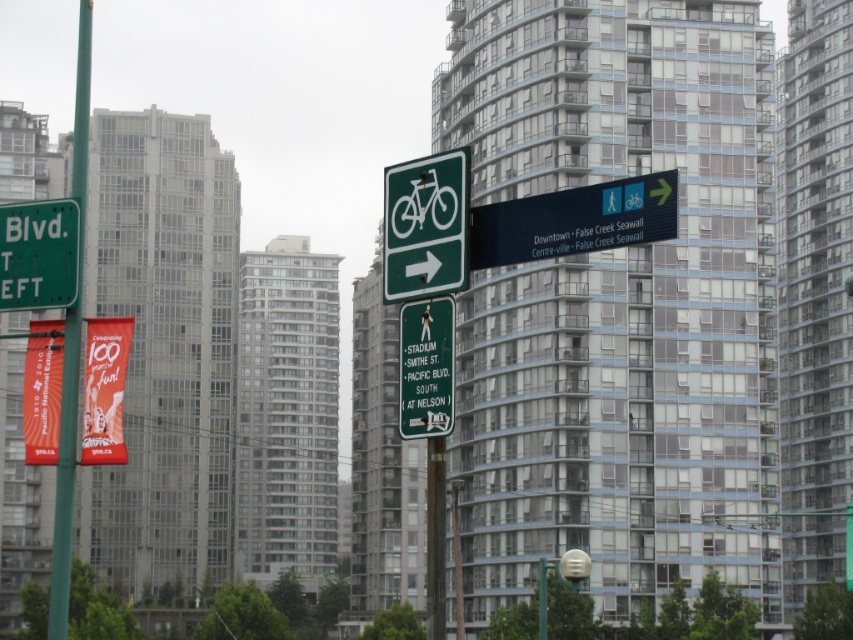
This screenshot has height=640, width=853. I want to click on green matte sign at upper left, so click(38, 253).

Does green matte sign at upper left appear on the right side of green matte sign at center?

No, green matte sign at upper left is not to the right of green matte sign at center.

Between point (74, 202) and point (402, 396), which one is positioned in front?

Point (402, 396) is more forward.

You are a GUI agent. You are given a task and a screenshot of the screen. Output one action in this format:
    pyautogui.click(x=<x>, y=<y>)
    Task: Click on the green matte sign at upper left
    The image size is (853, 640).
    Given the screenshot: What is the action you would take?
    pyautogui.click(x=38, y=253)

Between green matte bicycle at center and green matte sign at center, which one appears on the left side from the viewer's perspective?

From the viewer's perspective, green matte sign at center appears more on the left side.

Between point (461, 268) and point (425, 301), which one is positioned behind?

The point (425, 301) is more distant.

At what (x,y) coordinates should I click in order to perform the action: click on green matte bicycle at center. Please return your answer as a coordinate pair (x, y). The image size is (853, 640). Looking at the image, I should click on (426, 227).

Who is more distant from viewer, (x=567, y=198) or (x=409, y=435)?

The point (x=409, y=435) is behind.

Does dark blue plastic sign at center appear on the left side of green matte sign at center?

In fact, dark blue plastic sign at center is to the right of green matte sign at center.

Find the location of `dark blue plastic sign at center`. dark blue plastic sign at center is located at coordinates (573, 220).